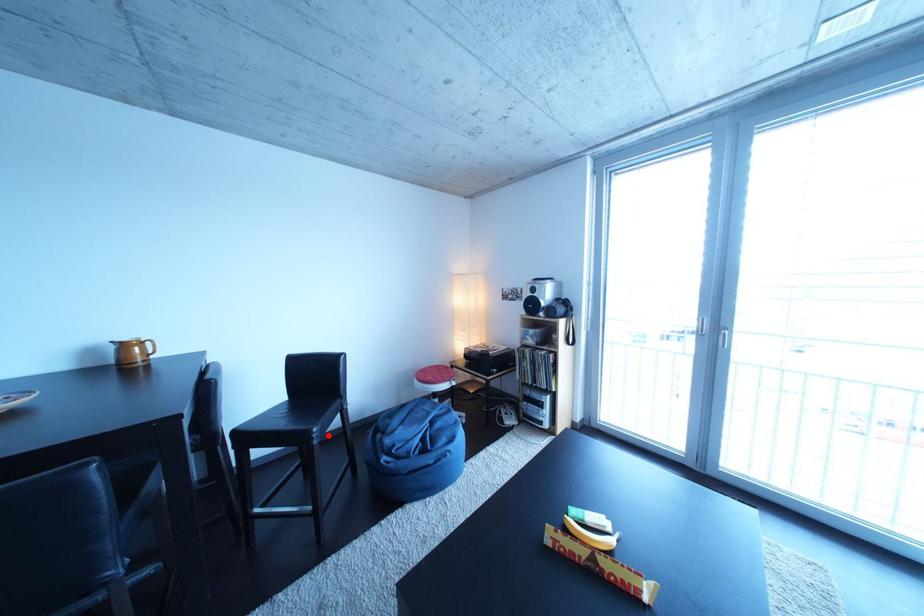
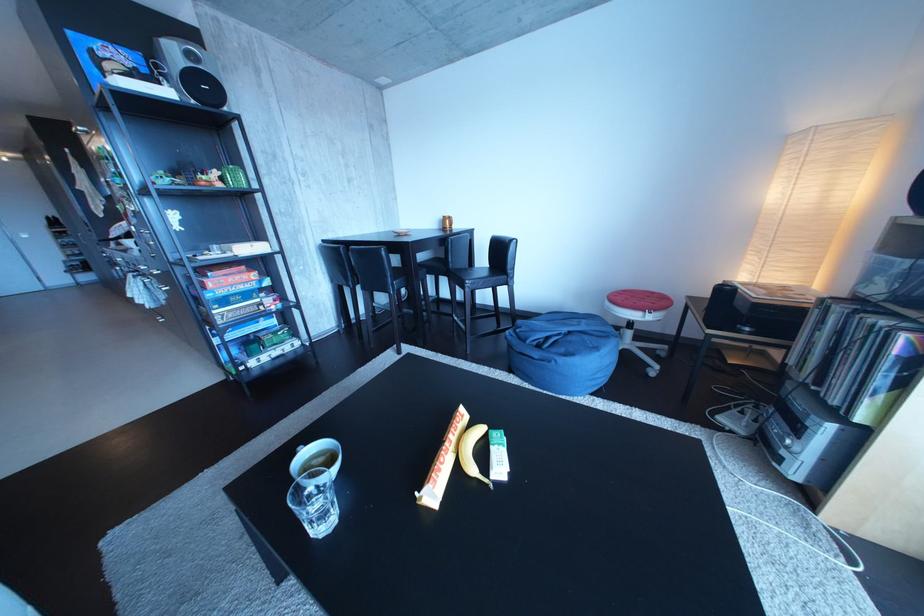
Question: I am providing you with two images of the same scene from different viewpoints. In image1, a red point is highlighted. Considering the same 3D point in image2, which of the following is correct?

Choices:
 (A) It is closer
 (B) It is farther

Answer: (A)